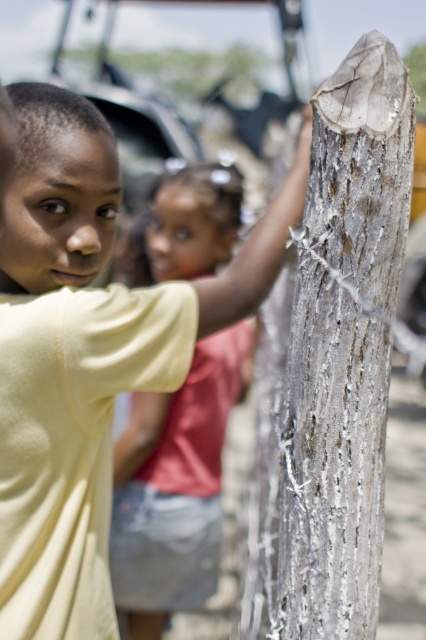
Does gray rough wood post at right have a greater width compared to matte yellow shirt at center?

No, gray rough wood post at right is not wider than matte yellow shirt at center.

Who is higher up, gray rough wood post at right or matte yellow shirt at center?

matte yellow shirt at center is higher up.

Is point (290, 568) positioned before point (238, 189)?

Yes, point (290, 568) is in front of point (238, 189).

Locate an element on the screen. This screenshot has height=640, width=426. gray rough wood post at right is located at coordinates point(331,365).

Can you confirm if yellow matte shirt at upper left is positioned to the left of gray rough wood post at right?

Yes, yellow matte shirt at upper left is to the left of gray rough wood post at right.

Consider the image. Who is taller, yellow matte shirt at upper left or gray rough wood post at right?

gray rough wood post at right is taller.

At what (x,y) coordinates should I click in order to perform the action: click on yellow matte shirt at upper left. Please return your answer as a coordinate pair (x, y). This screenshot has height=640, width=426. Looking at the image, I should click on (89, 355).

In the scene shown: Can you confirm if yellow matte shirt at upper left is positioned below matte yellow shirt at center?

Actually, yellow matte shirt at upper left is above matte yellow shirt at center.

Is point (51, 477) positioned before point (160, 227)?

Yes, point (51, 477) is closer to viewer.

Does point (11, 480) come in front of point (135, 468)?

Yes, it is.

I want to click on yellow matte shirt at upper left, so click(x=89, y=355).